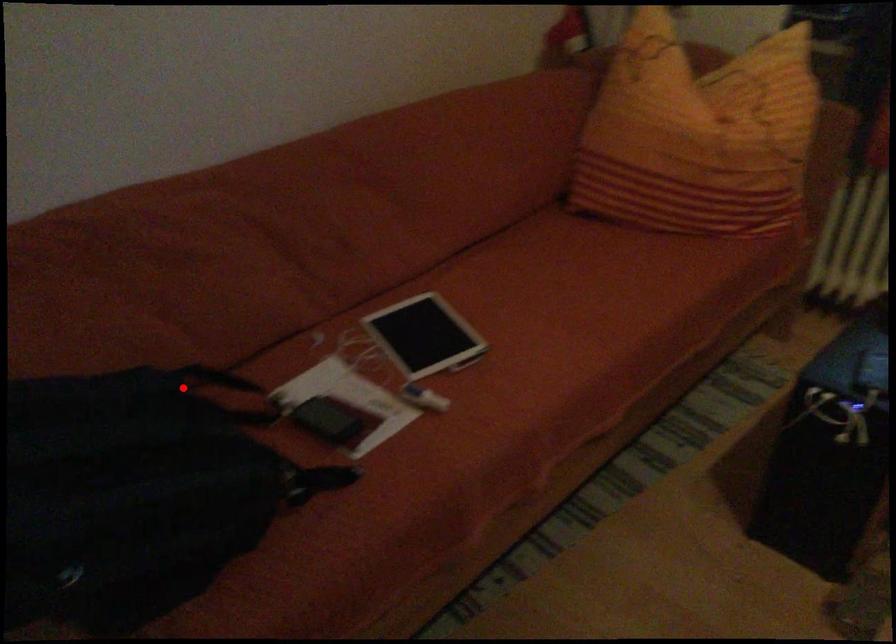
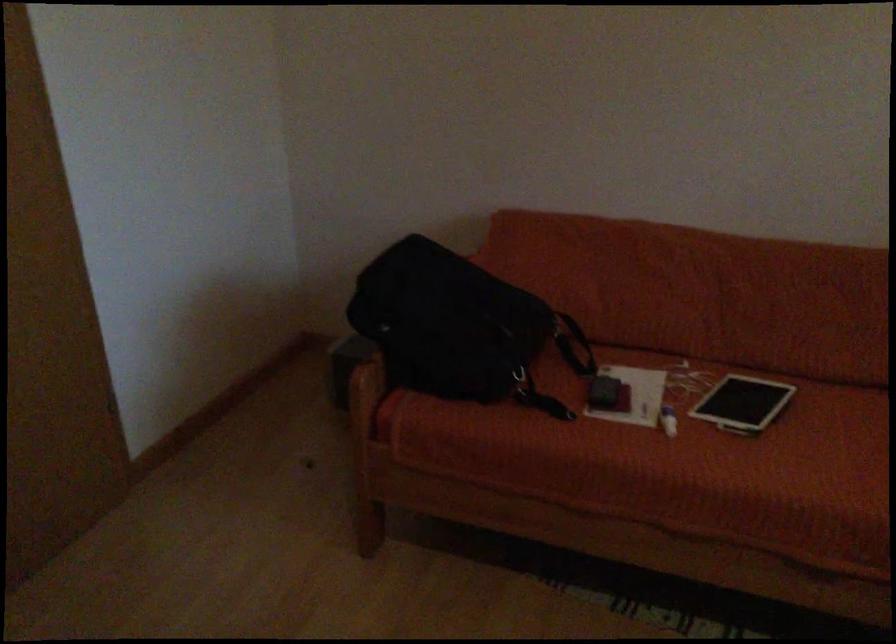
Where in the second image is the point corresponding to the highlighted location from the first image?

(567, 332)